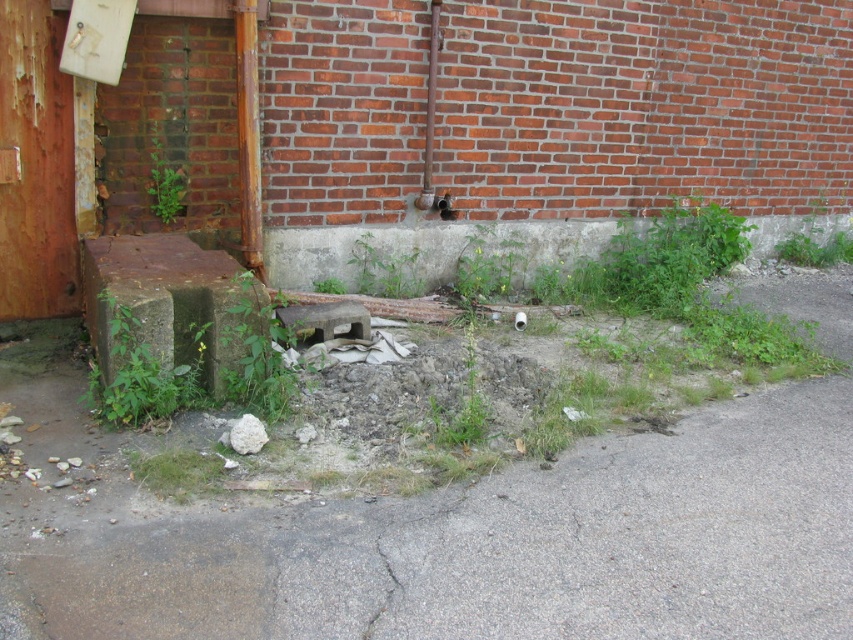
Question: Considering the real-world distances, which object is farthest from the gray asphalt pavement at lower center?

Choices:
 (A) green leafy weed at center
 (B) green leafy weed at lower left
 (C) green leafy plant at center-left

Answer: (C)

Question: Which object appears closest to the camera in this image?

Choices:
 (A) green leafy weed at center
 (B) green leafy plant at center-left
 (C) gray asphalt pavement at lower center
 (D) green leafy weed at lower left

Answer: (C)

Question: Is green leafy weed at center closer to the viewer compared to green leafy plant at center-left?

Choices:
 (A) yes
 (B) no

Answer: (A)

Question: Can you confirm if gray asphalt pavement at lower center is smaller than green leafy plant at center-left?

Choices:
 (A) no
 (B) yes

Answer: (A)

Question: Which point is farther to the camera?

Choices:
 (A) green leafy weed at lower left
 (B) gray asphalt pavement at lower center
 (C) green leafy weed at center

Answer: (C)

Question: Does gray asphalt pavement at lower center appear over green leafy weed at center?

Choices:
 (A) yes
 (B) no

Answer: (B)